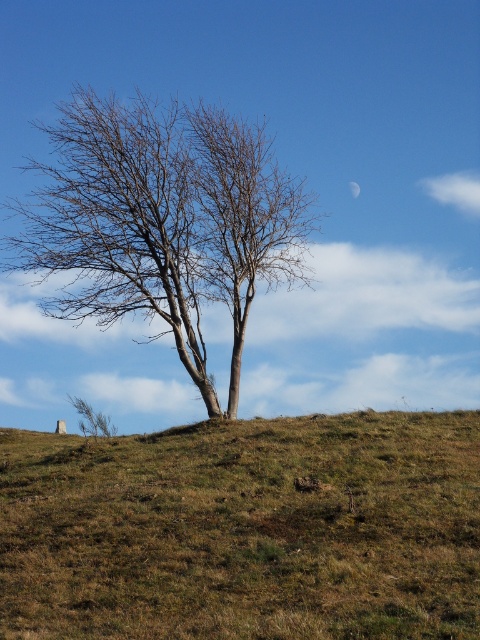
You are a hiker trying to determine the best spot to set up a tent. You have two options near the brown grassy hillside at center and the bare wood tree at center. Considering their sizes, which location would provide more space for your tent? Please explain your reasoning based on the scene description.

The brown grassy hillside at center has a smaller size compared to the bare wood tree at center. Therefore, the area around the bare wood tree at center would provide more space for setting up a tent since it is larger.

You are a hiker trying to cross from the left to the right side of the hill. You see the brown grassy hillside at center and the bare wood tree at center. Which path would allow you to pass through without going near the tree?

The brown grassy hillside at center has a larger width than the bare wood tree at center, so you can pass through the brown grassy hillside at center to avoid the tree.

You are standing at the base of the tree and want to place a small flag at each of the two points marked in the image. Which point should you place the flag closer to the camera? Please choose between point (382, 579) and point (358, 188).

You should place the flag at point (382, 579) because it is closer to the camera than point (358, 188) according to the description.